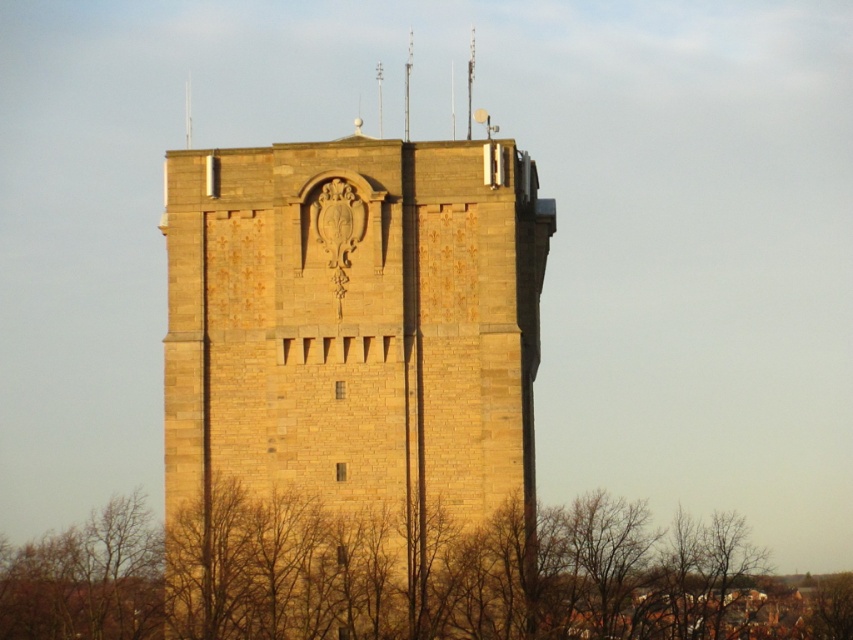
You are standing at the base of the golden stone tower at center and looking towards the brown leafless branches at lower center. Which object is taller?

The golden stone tower at center is taller than the brown leafless branches at lower center.

You are standing in a field and see the golden stone tower at center. If you want to locate it precisely on a map, what are its coordinates?

The golden stone tower at center is located at coordinates point (x=352, y=390).